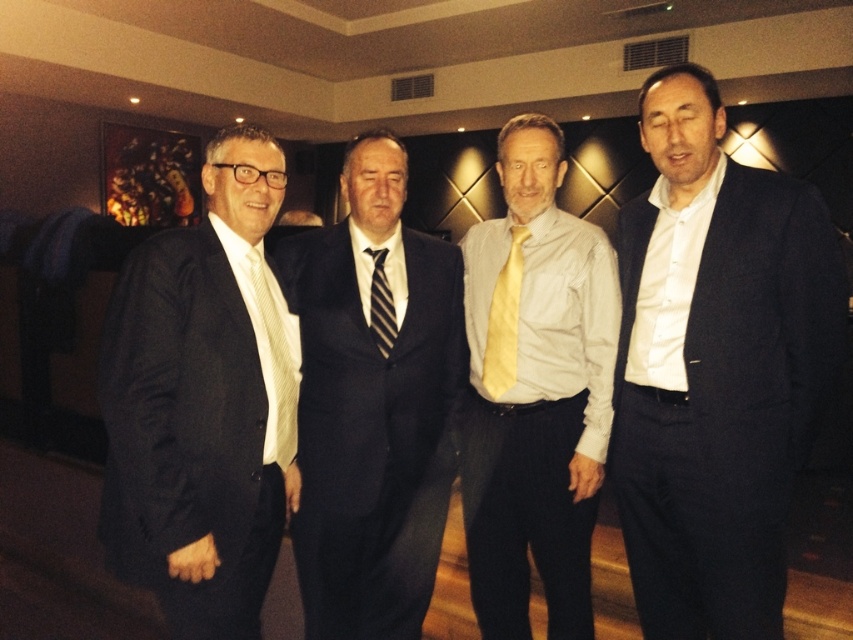
Question: Which of these objects is positioned farthest from the matte black suit at left?

Choices:
 (A) light yellow striped tie at left
 (B) light gray shirt with yellow tie at center
 (C) yellow satin tie at center
 (D) striped fabric tie at center

Answer: (B)

Question: Can you confirm if matte black suit at left is smaller than dark blue suit at center?

Choices:
 (A) no
 (B) yes

Answer: (A)

Question: Is matte black suit at left smaller than light gray shirt with yellow tie at center?

Choices:
 (A) yes
 (B) no

Answer: (B)

Question: Can you confirm if matte black suit at left is positioned above light gray shirt with yellow tie at center?

Choices:
 (A) yes
 (B) no

Answer: (A)

Question: Which point is closer to the camera?

Choices:
 (A) (372, 196)
 (B) (486, 324)

Answer: (A)

Question: Which of these objects is positioned closest to the dark blue suit at center?

Choices:
 (A) yellow satin tie at center
 (B) striped fabric tie at center
 (C) dark blue suit at right

Answer: (B)